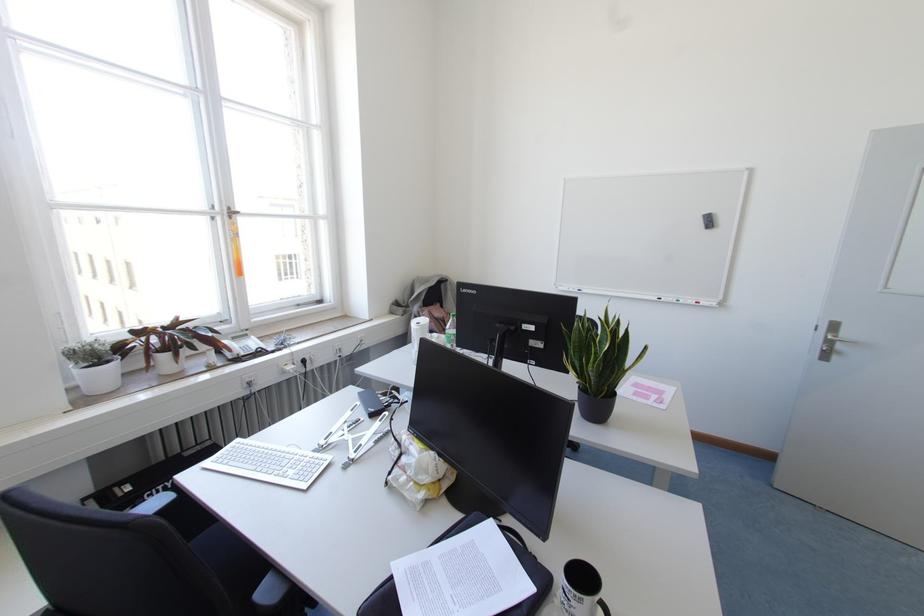
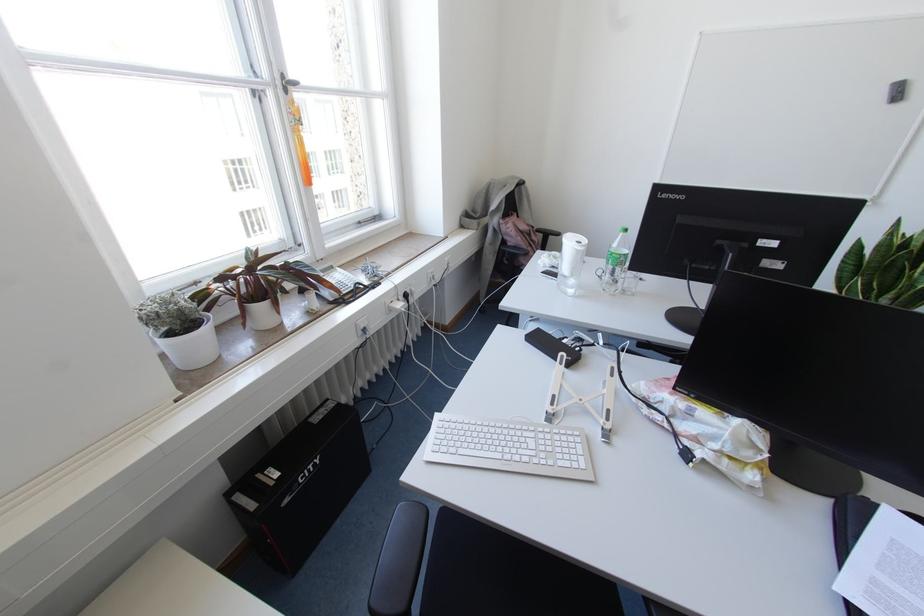
In the second image, find the point that corresponds to (x=104, y=344) in the first image.

(186, 298)